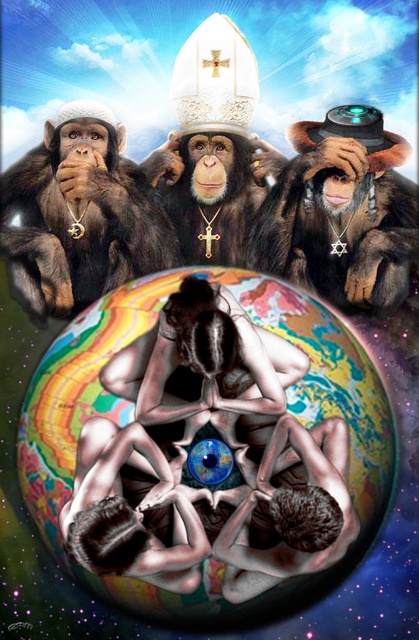
You are an art curator examining the surreal composition. The shiny black hat at center and the smooth skin figure at center are both central to the artwork. Which object is closer to you?

The shiny black hat at center is closer to you than the smooth skin figure at center.

In the surreal scene described, there are two central figures, the metallic silver person at center and the smooth skin figure at center. From the perspective of an observer looking at the image, which one is positioned to the right?

The metallic silver person at center is positioned to the right of the smooth skin figure at center.